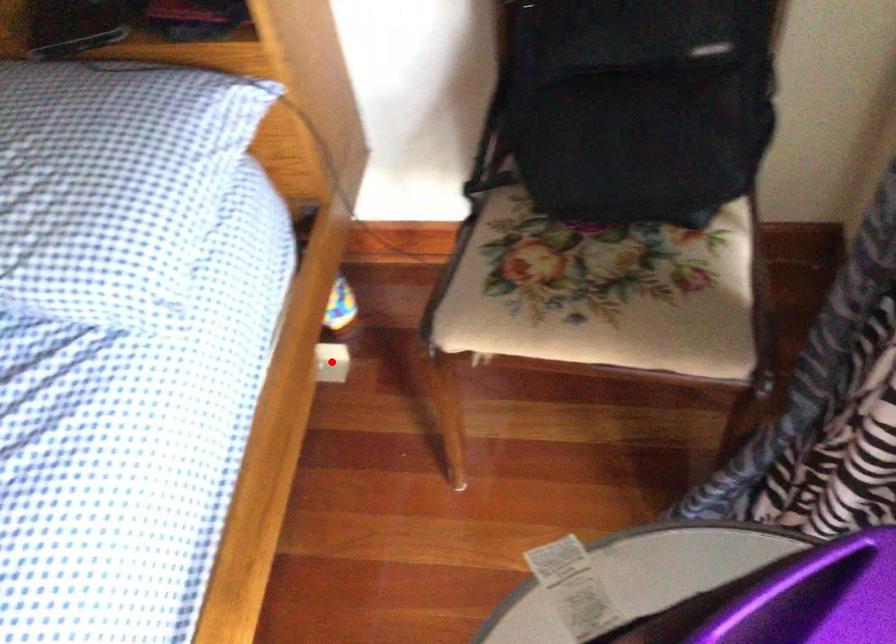
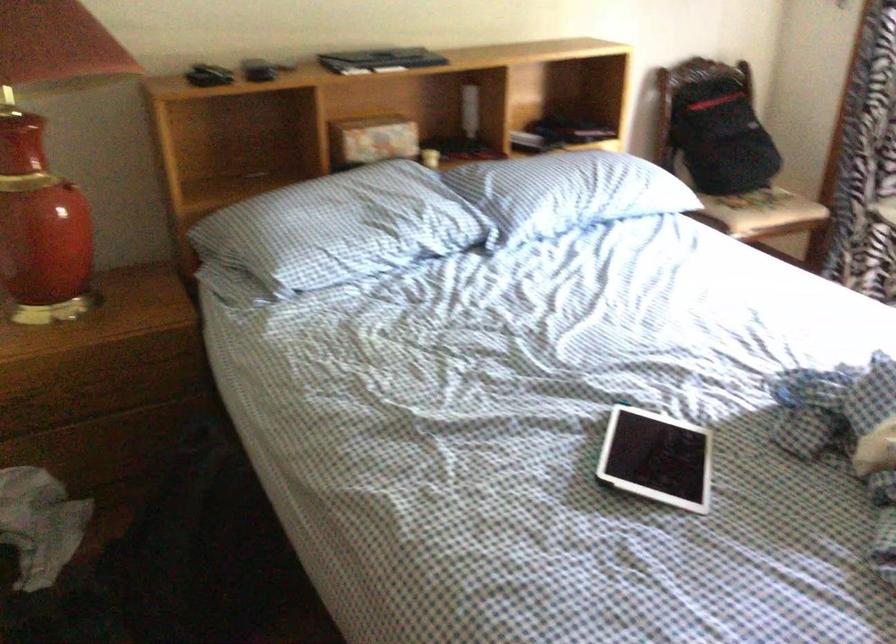
Question: I am providing you with two images of the same scene from different viewpoints. A red point is marked on the first image. Is the red point's position out of view in image 2?

Choices:
 (A) Yes
 (B) No

Answer: (A)